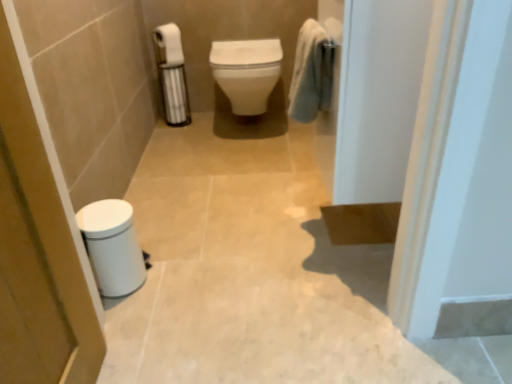
Question: Considering the positions of soft blue towel at upper right and white glossy trash can at lower left in the image, is soft blue towel at upper right taller or shorter than white glossy trash can at lower left?

Choices:
 (A) tall
 (B) short

Answer: (B)

Question: Does point (332, 46) appear closer or farther from the camera than point (104, 264)?

Choices:
 (A) farther
 (B) closer

Answer: (B)

Question: Considering the real-world distances, which object is closest to the soft blue towel at upper right?

Choices:
 (A) white matte toilet paper at upper left
 (B) white glossy trash can at lower left
 (C) white glossy screen door at upper right, which appears as the 2th screen door when viewed from the left
 (D) white matte trash can at lower left, positioned as the 1th screen door in left-to-right order
 (E) white glossy toilet at center

Answer: (C)

Question: Which object is positioned farthest from the white glossy toilet at center?

Choices:
 (A) white glossy screen door at upper right, which appears as the 2th screen door when viewed from the left
 (B) soft blue towel at upper right
 (C) white glossy trash can at lower left
 (D) white matte toilet paper at upper left
 (E) white matte trash can at lower left, positioned as the 1th screen door in left-to-right order

Answer: (E)